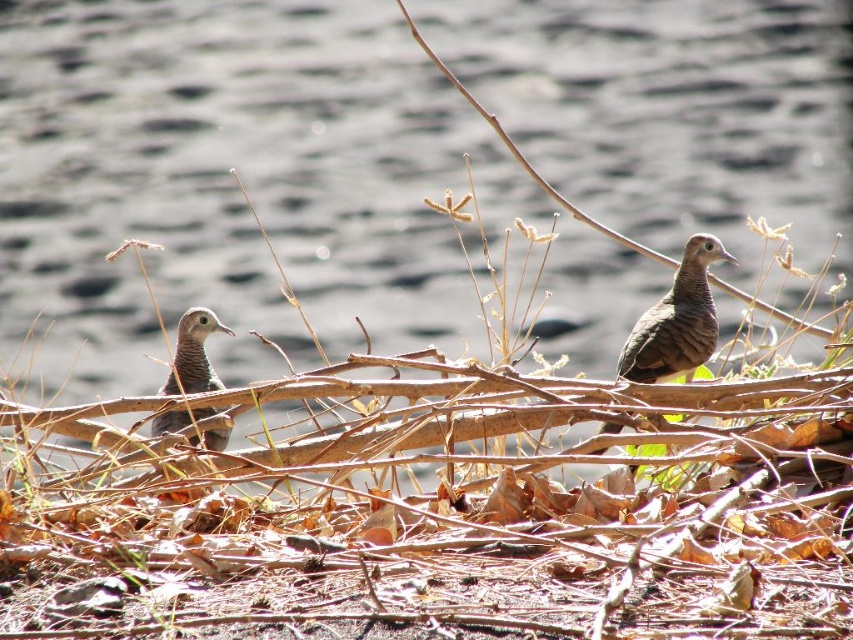
Does brown speckled feathers at center appear on the left side of brown speckled feathers at left?

Incorrect, brown speckled feathers at center is not on the left side of brown speckled feathers at left.

Identify the location of brown speckled feathers at center. Image resolution: width=853 pixels, height=640 pixels. (676, 321).